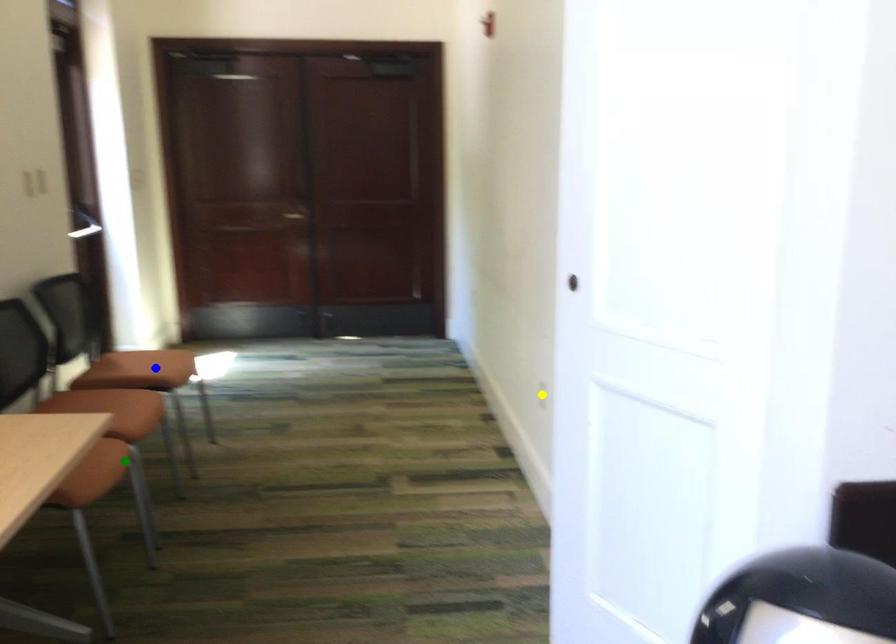
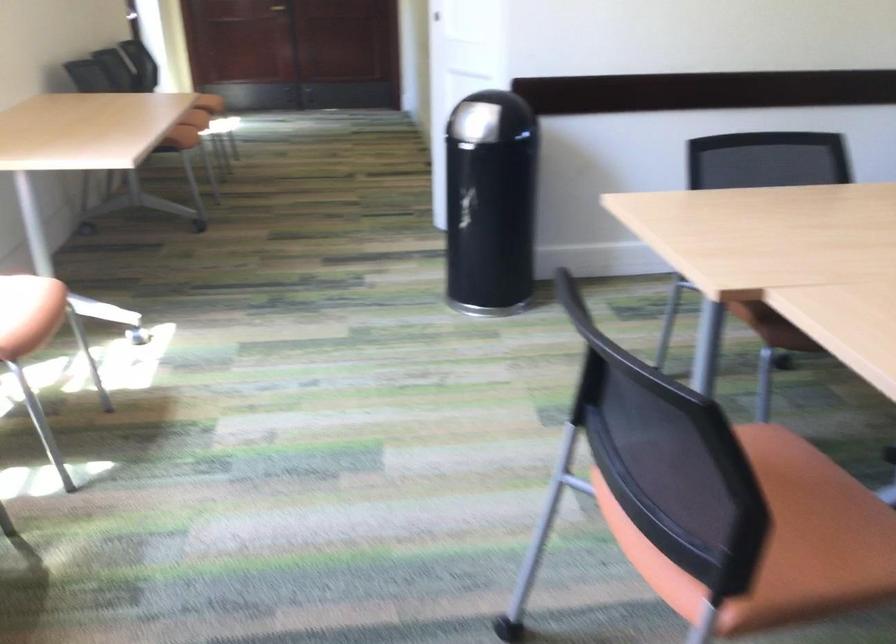
I am providing you with two images of the same scene from different viewpoints. Three points are marked in image1. Which point corresponds to a part or object that is occluded in image2?In image1, three points are marked. Which of them correspond to a part or object that is occluded in image2?Among the three points shown in image1, which one corresponds to a part or object that is no longer visible due to occlusion in image2?

blue point, yellow point cannot be seen in image2.